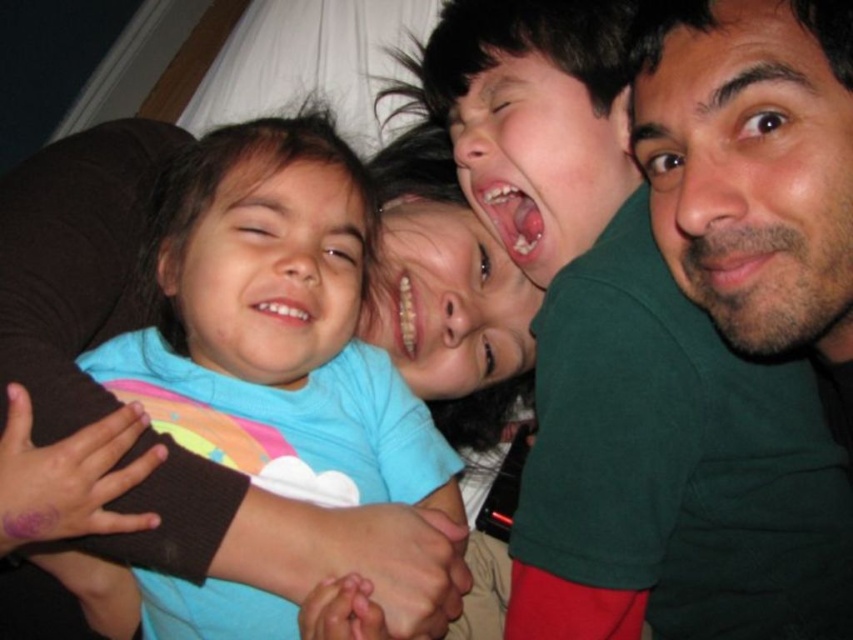
Question: Which of the following is the farthest from the observer?

Choices:
 (A) (311, 298)
 (B) (515, 195)
 (C) (764, 148)

Answer: (B)

Question: Which point is closer to the camera?

Choices:
 (A) (527, 259)
 (B) (833, 33)
 (C) (370, 364)

Answer: (B)

Question: Is blue cotton shirt at left positioned before green matte face at upper right?

Choices:
 (A) yes
 (B) no

Answer: (B)

Question: Is blue cotton shirt at left bigger than smooth pink lips at center?

Choices:
 (A) yes
 (B) no

Answer: (A)

Question: Estimate the real-world distances between objects in this image. Which object is farther from the green matte face at upper right?

Choices:
 (A) blue cotton shirt at left
 (B) smooth pink lips at center

Answer: (A)

Question: Can you confirm if blue cotton shirt at left is positioned above green matte face at upper right?

Choices:
 (A) yes
 (B) no

Answer: (B)